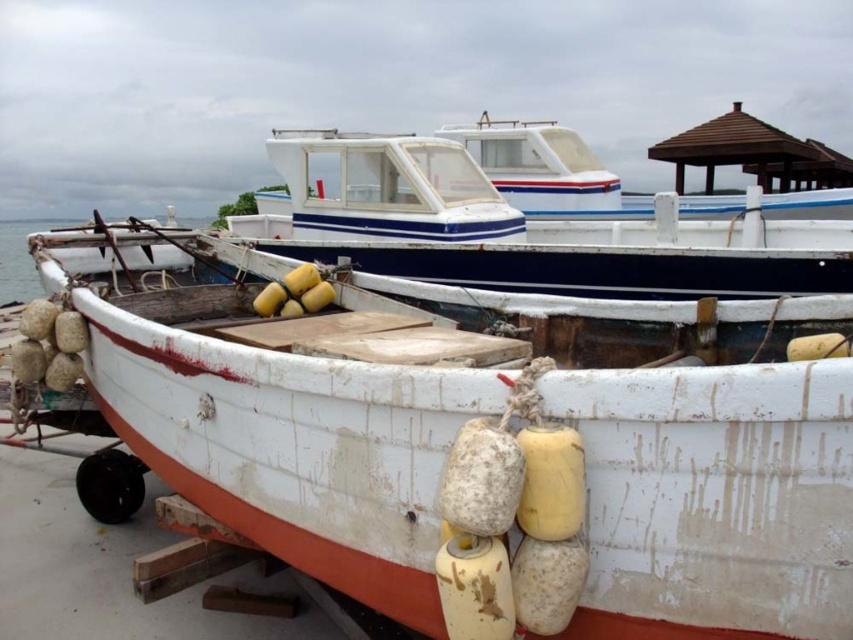
Question: Which point is closer to the camera?

Choices:
 (A) transparent water at boat front
 (B) white weathered wood boat at lower left
 (C) white matte boat at center

Answer: (B)

Question: Where is white weathered wood boat at lower left located in relation to white matte boat at center in the image?

Choices:
 (A) left
 (B) right

Answer: (A)

Question: Is white weathered wood boat at lower left thinner than transparent water at boat front?

Choices:
 (A) no
 (B) yes

Answer: (B)

Question: Where is white weathered wood boat at lower left located in relation to transparent water at boat front in the image?

Choices:
 (A) left
 (B) right

Answer: (B)

Question: Among these points, which one is nearest to the camera?

Choices:
 (A) 209,428
 (B) 375,134
 (C) 10,292

Answer: (A)

Question: Which object is positioned farthest from the white matte boat at center?

Choices:
 (A) white weathered wood boat at lower left
 (B) transparent water at boat front

Answer: (B)